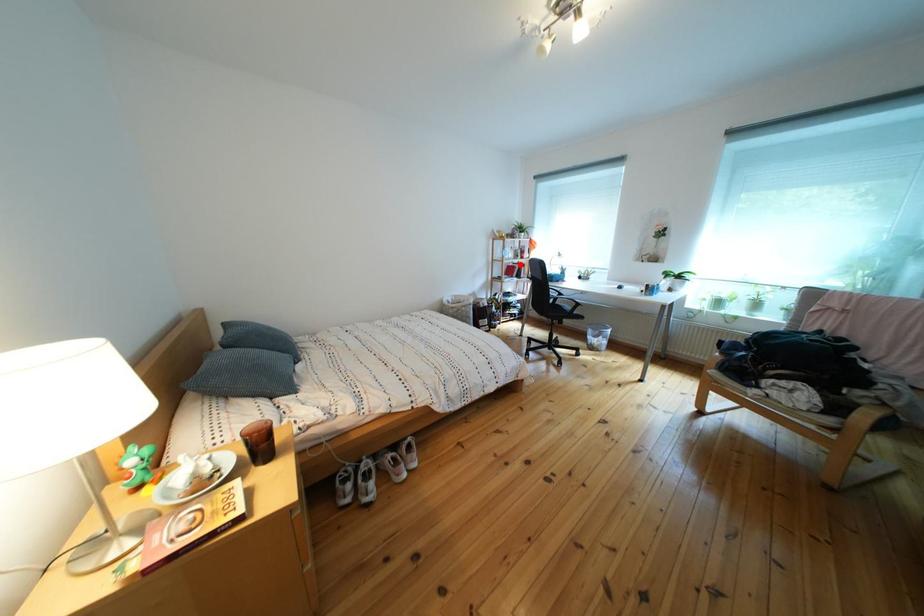
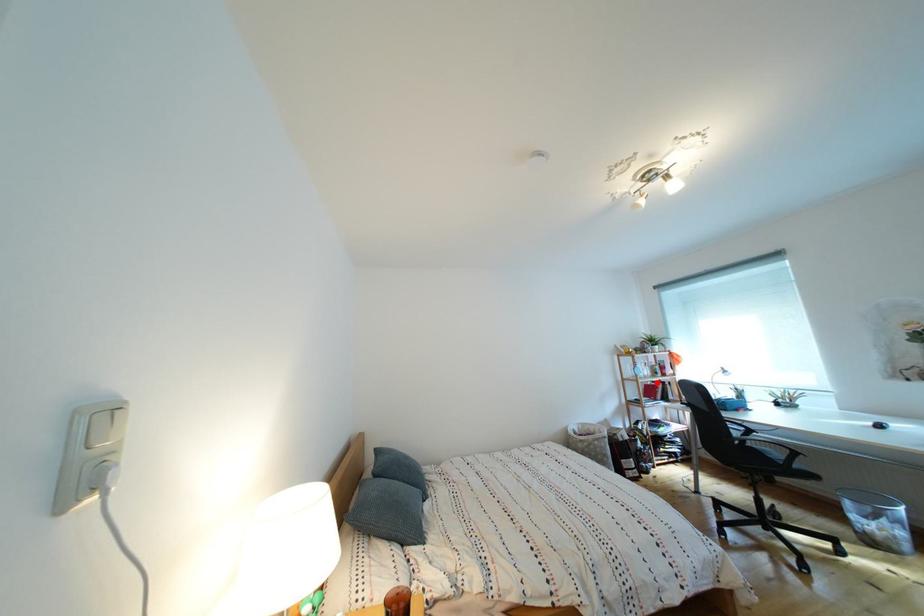
I am providing you with two images of the same scene from different viewpoints. A red point is marked on the first image and another point is marked on the second image. Are the points marked in image1 and image2 representing the same 3D position?

Yes